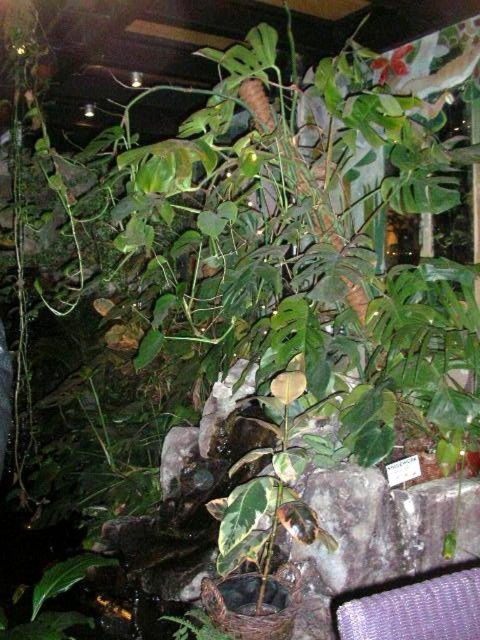
Question: Is purple woven chair at lower right below green glossy leaf at center?

Choices:
 (A) yes
 (B) no

Answer: (B)

Question: Does purple woven chair at lower right appear on the right side of green glossy leaf at center?

Choices:
 (A) no
 (B) yes

Answer: (B)

Question: Can you confirm if purple woven chair at lower right is positioned to the right of green glossy leaf at center?

Choices:
 (A) no
 (B) yes

Answer: (B)

Question: Which point appears farthest from the camera in this image?

Choices:
 (A) (352, 618)
 (B) (210, 621)

Answer: (B)

Question: Among these points, which one is nearest to the camera?

Choices:
 (A) (183, 628)
 (B) (466, 566)

Answer: (A)